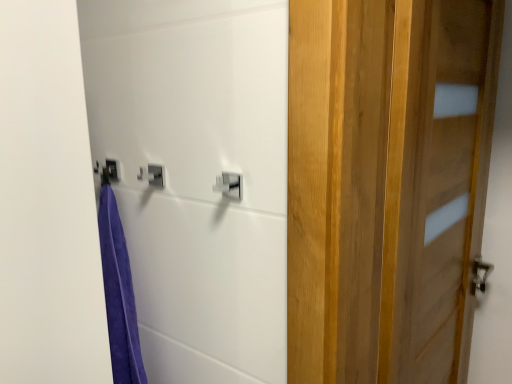
Question: From the image's perspective, is wooden door at right above silver metallic lock at center?

Choices:
 (A) yes
 (B) no

Answer: (B)

Question: Is wooden door at right located outside silver metallic lock at center?

Choices:
 (A) no
 (B) yes

Answer: (B)

Question: Is wooden door at right wider than silver metallic lock at center?

Choices:
 (A) no
 (B) yes

Answer: (B)

Question: Is wooden door at right touching silver metallic lock at center?

Choices:
 (A) yes
 (B) no

Answer: (B)

Question: From a real-world perspective, is wooden door at right beneath silver metallic lock at center?

Choices:
 (A) no
 (B) yes

Answer: (B)

Question: Considering the relative sizes of wooden door at right and silver metallic lock at center in the image provided, is wooden door at right smaller than silver metallic lock at center?

Choices:
 (A) no
 (B) yes

Answer: (A)

Question: From the image's perspective, would you say silver metallic lock at center is shown under wooden door at right?

Choices:
 (A) no
 (B) yes

Answer: (A)

Question: Can you confirm if silver metallic lock at center is shorter than wooden door at right?

Choices:
 (A) no
 (B) yes

Answer: (B)

Question: Considering the relative sizes of silver metallic lock at center and wooden door at right in the image provided, is silver metallic lock at center taller than wooden door at right?

Choices:
 (A) yes
 (B) no

Answer: (B)

Question: From the image's perspective, is silver metallic lock at center located above wooden door at right?

Choices:
 (A) yes
 (B) no

Answer: (A)

Question: Considering the relative sizes of silver metallic lock at center and wooden door at right in the image provided, is silver metallic lock at center smaller than wooden door at right?

Choices:
 (A) no
 (B) yes

Answer: (B)

Question: Would you consider silver metallic lock at center to be distant from wooden door at right?

Choices:
 (A) no
 (B) yes

Answer: (A)

Question: From a real-world perspective, is silver metallic lock at center positioned above or below wooden door at right?

Choices:
 (A) above
 (B) below

Answer: (A)